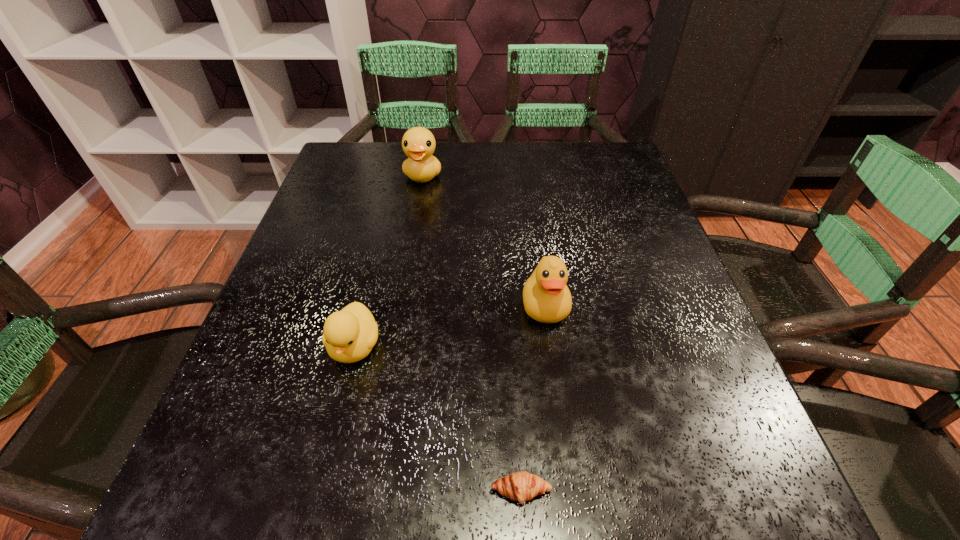
Locate an element on the screen. The width and height of the screenshot is (960, 540). empty space that is in between the farthest duck and the shortest object is located at coordinates (471, 333).

Image resolution: width=960 pixels, height=540 pixels. Identify the location of free spot between the shortest duck and the shortest object. (438, 418).

What are the coordinates of `vacant space in between the shortest duck and the farthest object` in the screenshot? It's located at (389, 261).

Find the location of a particular element. This screenshot has width=960, height=540. free spot between the pastry and the farthest object is located at coordinates (471, 333).

The height and width of the screenshot is (540, 960). In order to click on vacant area that lies between the rightmost duck and the pastry in this screenshot , I will do `click(533, 398)`.

What are the coordinates of `free point between the rightmost duck and the shortest duck` in the screenshot? It's located at (450, 326).

Locate an element on the screen. object that can be found as the closest to the shortest duck is located at coordinates coord(521,486).

Locate which object is the third closest to the farthest duck. Please provide its 2D coordinates. Your answer should be formatted as a tuple, i.e. [(x, y)], where the tuple contains the x and y coordinates of a point satisfying the conditions above.

[(521, 486)]

The width and height of the screenshot is (960, 540). I want to click on duck object that ranks as the second closest to the shortest duck, so click(418, 143).

You are a GUI agent. You are given a task and a screenshot of the screen. Output one action in this format:
    pyautogui.click(x=<x>, y=<y>)
    Task: Click on the duck identified as the second closest to the nearest object
    Image resolution: width=960 pixels, height=540 pixels.
    Given the screenshot: What is the action you would take?
    pyautogui.click(x=547, y=299)